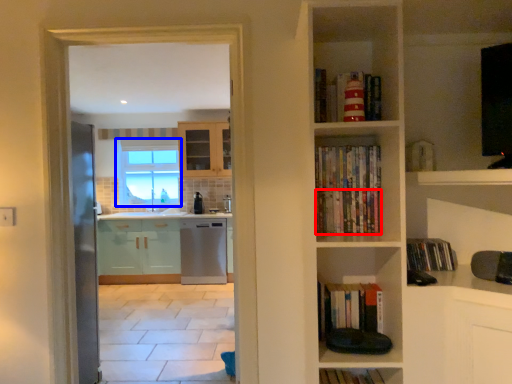
Question: Which point is closer to the camera, book (highlighted by a red box) or window (highlighted by a blue box)?

Choices:
 (A) book
 (B) window

Answer: (A)